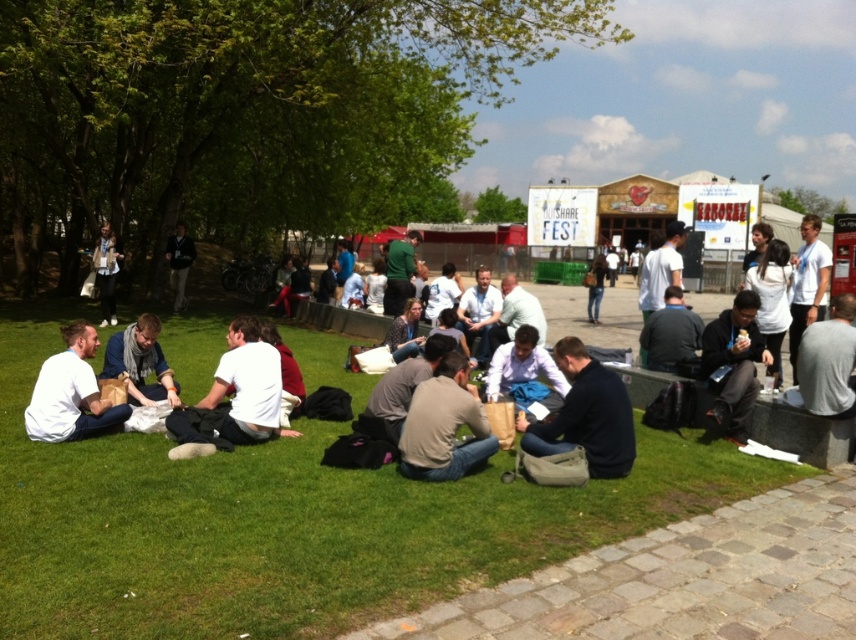
Locate an element on the screen. white cotton shirt at center is located at coordinates point(233,397).

Between white cotton shirt at center and black fabric jacket at lower right, which one has less height?

With less height is white cotton shirt at center.

Between point (253, 410) and point (735, 336), which one is positioned in front?

Point (253, 410) is more forward.

Locate an element on the screen. The width and height of the screenshot is (856, 640). white cotton shirt at center is located at coordinates (233, 397).

Measure the distance between white cotton shirt at center and gray fabric shirt at lower right.

A distance of 4.98 meters exists between white cotton shirt at center and gray fabric shirt at lower right.

The width and height of the screenshot is (856, 640). What do you see at coordinates (233, 397) in the screenshot?
I see `white cotton shirt at center` at bounding box center [233, 397].

Image resolution: width=856 pixels, height=640 pixels. I want to click on white cotton shirt at center, so click(x=233, y=397).

Find the location of a particular element. This screenshot has height=640, width=856. white cotton shirt at center is located at coordinates (233, 397).

Identify the location of black fabric jacket at lower right. (733, 365).

Is point (724, 422) closer to viewer compared to point (810, 342)?

No, (724, 422) is further to viewer.

Identify the location of black fabric jacket at lower right. Image resolution: width=856 pixels, height=640 pixels. [x=733, y=365].